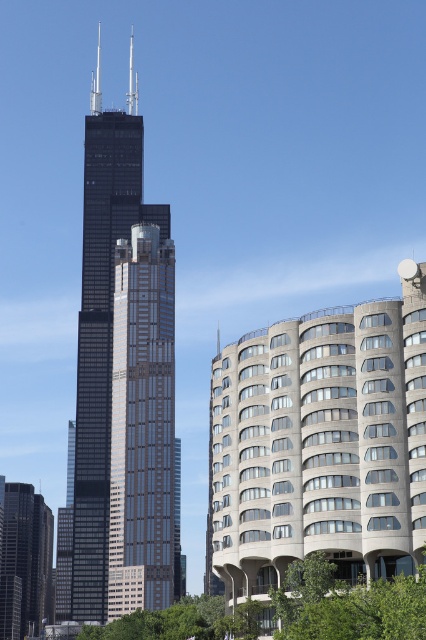
Can you confirm if black glass skyscraper at center is positioned above gold glass skyscraper at center?

Indeed, black glass skyscraper at center is positioned over gold glass skyscraper at center.

I want to click on black glass skyscraper at center, so click(x=123, y=384).

You are a GUI agent. You are given a task and a screenshot of the screen. Output one action in this format:
    pyautogui.click(x=<x>, y=<y>)
    Task: Click on the black glass skyscraper at center
    This screenshot has height=640, width=426.
    Given the screenshot: What is the action you would take?
    pyautogui.click(x=123, y=384)

You are a GUI agent. You are given a task and a screenshot of the screen. Output one action in this format:
    pyautogui.click(x=<x>, y=<y>)
    Task: Click on the black glass skyscraper at center
    This screenshot has height=640, width=426.
    Given the screenshot: What is the action you would take?
    pyautogui.click(x=123, y=384)

In the scene shown: Between gold glass skyscraper at center and green leafy tree at lower right, which one appears on the left side from the viewer's perspective?

Positioned to the left is gold glass skyscraper at center.

Is gold glass skyscraper at center to the right of green leafy tree at lower right from the viewer's perspective?

In fact, gold glass skyscraper at center is to the left of green leafy tree at lower right.

Locate an element on the screen. Image resolution: width=426 pixels, height=640 pixels. gold glass skyscraper at center is located at coordinates (141, 424).

Can you confirm if gray concrete building at right is thinner than gold glass skyscraper at center?

Incorrect, gray concrete building at right's width is not less than gold glass skyscraper at center's.

Does gray concrete building at right appear on the right side of gold glass skyscraper at center?

Correct, you'll find gray concrete building at right to the right of gold glass skyscraper at center.

This screenshot has width=426, height=640. I want to click on gray concrete building at right, so click(319, 444).